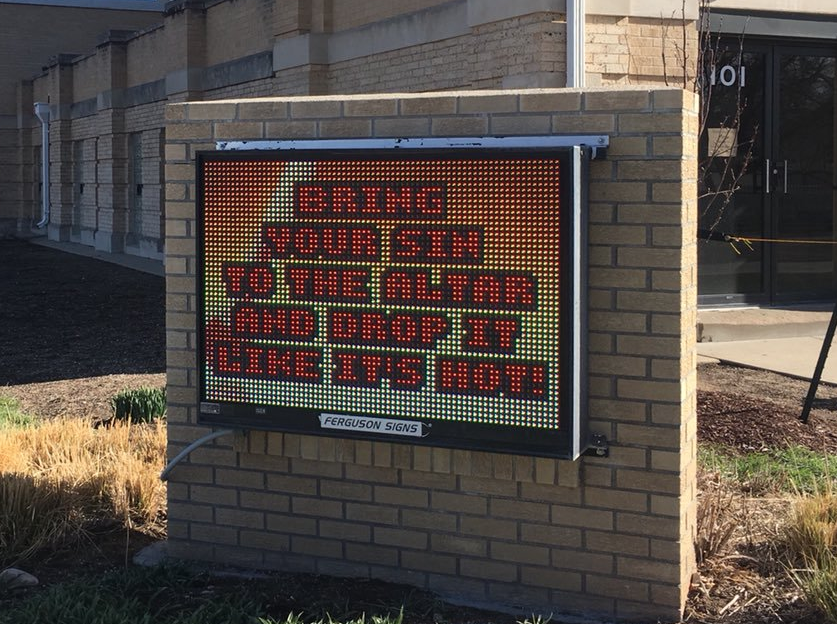
Where is `door`? This screenshot has width=837, height=624. door is located at coordinates (787, 138).